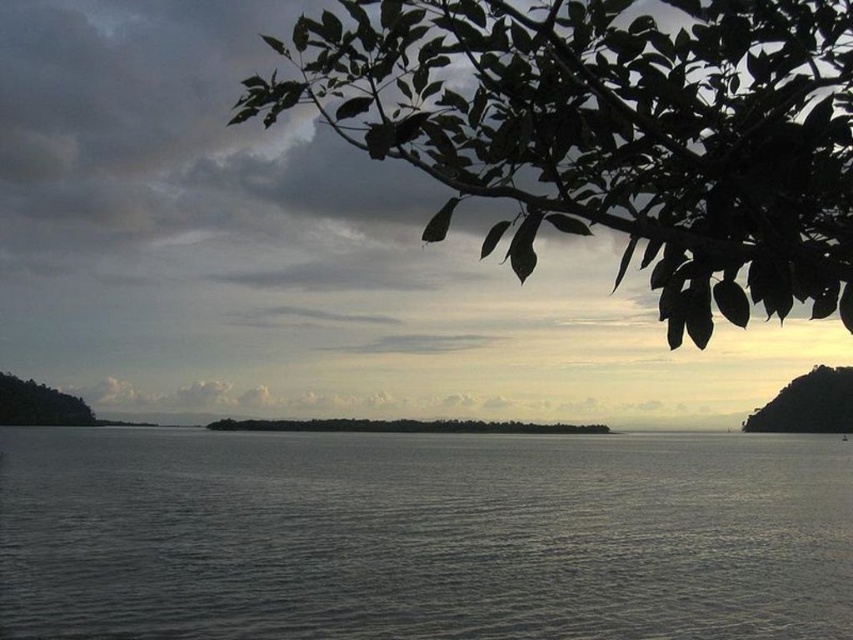
You are standing at the edge of the water in the serene landscape scene. You see two points marked in the image. Which point, point (647, 150) or point (781, 412), is closer to your position?

Point (647, 150) is closer to the camera than point (781, 412), so it is closer to your position.

You are an artist trying to paint this landscape. You notice the green leafy branch at upper right and the green matte hill at right. Which object should you make larger in your painting to accurately represent their sizes as seen in the image?

The green leafy branch at upper right is smaller than the green matte hill at right, so you should make the green matte hill at right larger than the green leafy branch at upper right in your painting.